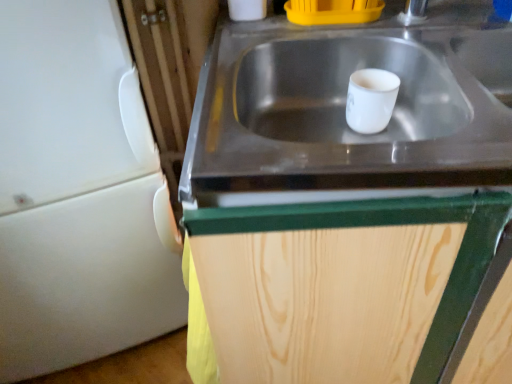
Question: In the image, is white matte refrigerator at left positioned in front of or behind wooden cabinet at center?

Choices:
 (A) front
 (B) behind

Answer: (B)

Question: Looking at the image, does white matte refrigerator at left seem bigger or smaller compared to wooden cabinet at center?

Choices:
 (A) big
 (B) small

Answer: (B)

Question: Based on their relative distances, which object is farther from the white matte refrigerator at left?

Choices:
 (A) wooden cabinet at center
 (B) stainless steel sink at center
 (C) white glossy mug at center

Answer: (C)

Question: Based on their relative distances, which object is farther from the white matte refrigerator at left?

Choices:
 (A) white glossy mug at center
 (B) stainless steel sink at center
 (C) wooden cabinet at center

Answer: (A)